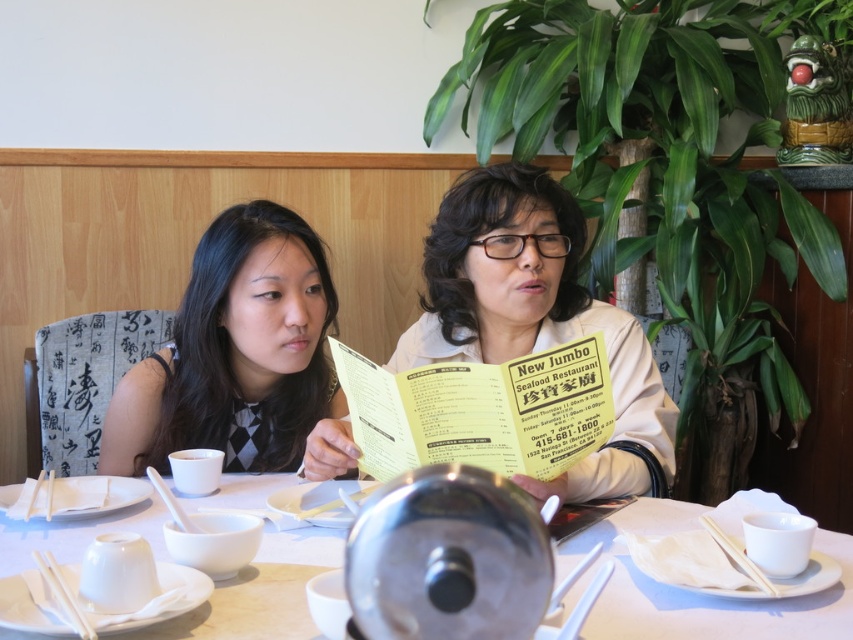
You are a waiter at the New Jumbo Seafood Restaurant. You need to place a small teapot on the table between the beige fabric jacket at center and the black textured dress at left. Where should you place the teapot to ensure it is between them?

The beige fabric jacket at center is in front of the black textured dress at left, so you should place the small teapot between them along the depth axis, positioning it closer to the front of the beige fabric jacket at center and behind the black textured dress at left.

You are a server at the New Jumbo Seafood Restaurant. You need to place a 12 inch wide dessert plate between the beige fabric jacket at center and the menu. Is there enough space?

The beige fabric jacket at center and the menu are 36.00 inches apart. Since the dessert plate is only 12 inches wide, there is sufficient space to place it between them.

You are a waiter at the New Jumbo Seafood Restaurant and need to place a new menu on the table. The menu is too large to fit between the two points on the table. Which point should you avoid placing the menu near to ensure it doesn not block the existing items? Please choose between point A at (614, 344) and point B at (503, 413).

You should avoid placing the menu near point B at (503, 413) because point A at (614, 344) is behind it, so placing the menu near point B would block the items at point A.